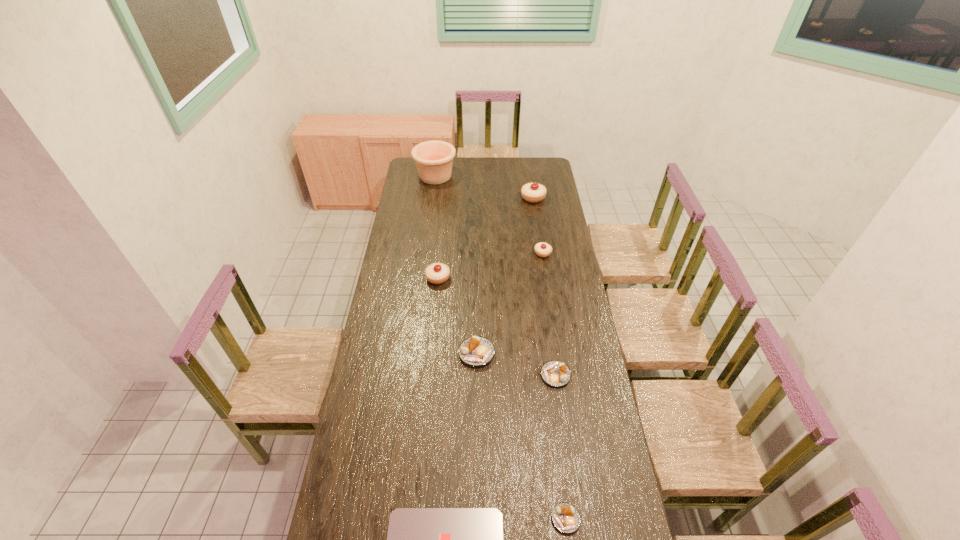
Locate an element on the screen. Image resolution: width=960 pixels, height=540 pixels. vacant space located on the back of the nearest brown pastry is located at coordinates (554, 429).

Identify the location of object that is at the far edge. This screenshot has width=960, height=540. (434, 159).

This screenshot has height=540, width=960. Find the location of `object at the left edge`. object at the left edge is located at coordinates (434, 159).

The width and height of the screenshot is (960, 540). Identify the location of object that is at the far left corner. (434, 159).

Locate an element on the screen. This screenshot has height=540, width=960. vacant point at the far edge is located at coordinates (518, 166).

Where is `vacant space at the left edge of the desktop`? The width and height of the screenshot is (960, 540). vacant space at the left edge of the desktop is located at coordinates (424, 187).

Locate an element on the screen. free region at the right edge is located at coordinates (562, 273).

The image size is (960, 540). I want to click on empty space between the third tallest object and the tallest object, so click(437, 227).

The height and width of the screenshot is (540, 960). What are the coordinates of `free space between the third shortest object and the leftmost beige pastry` in the screenshot? It's located at (496, 327).

This screenshot has width=960, height=540. In order to click on free spot between the seventh tallest object and the biggest brown pastry in this screenshot , I will do `click(521, 436)`.